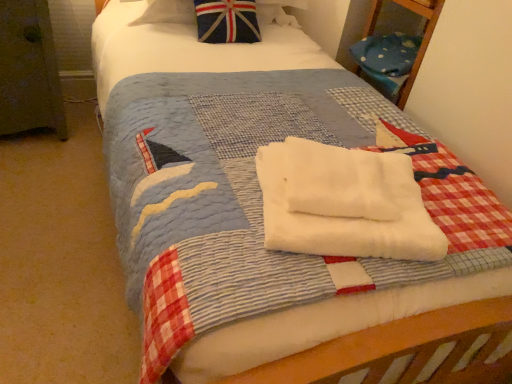
At what (x,y) coordinates should I click in order to perform the action: click on vacant region above white soft towel at center, which is the second beach towel from top to bottom (from a real-world perspective). Please return your answer as a coordinate pair (x, y). This screenshot has height=384, width=512. Looking at the image, I should click on (342, 183).